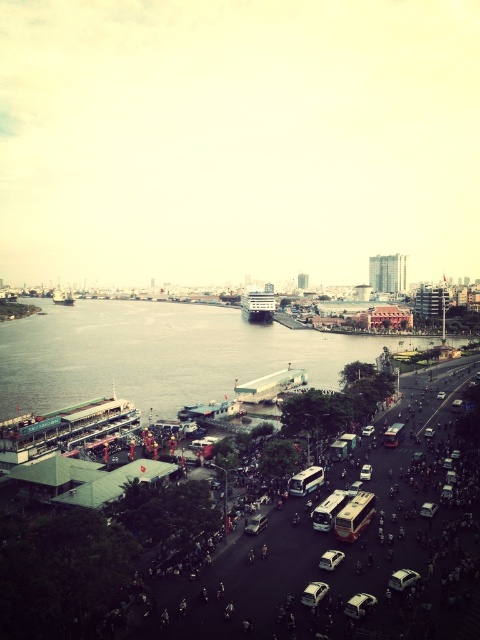
You are a pedestrian standing on the riverside street and want to cross to the opposite side. You see a metallic silver bus at center and a white matte bus at center. Which bus is closer to you?

The metallic silver bus at center is positioned under the white matte bus at center, so the metallic silver bus at center is closer to you.